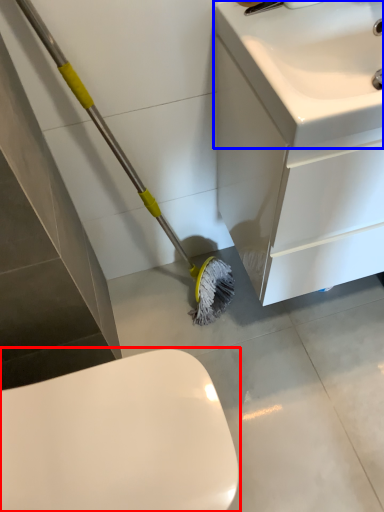
Question: Among these objects, which one is farthest to the camera, toilet (highlighted by a red box) or sink (highlighted by a blue box)?

Choices:
 (A) toilet
 (B) sink

Answer: (A)